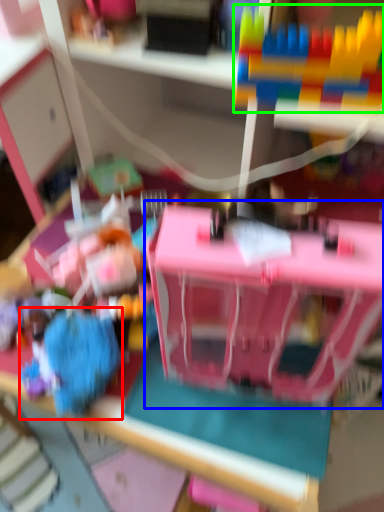
Question: Based on their relative distances, which object is nearer to toy (highlighted by a red box)? Choose from toy (highlighted by a blue box) and toy (highlighted by a green box).

Choices:
 (A) toy
 (B) toy

Answer: (A)